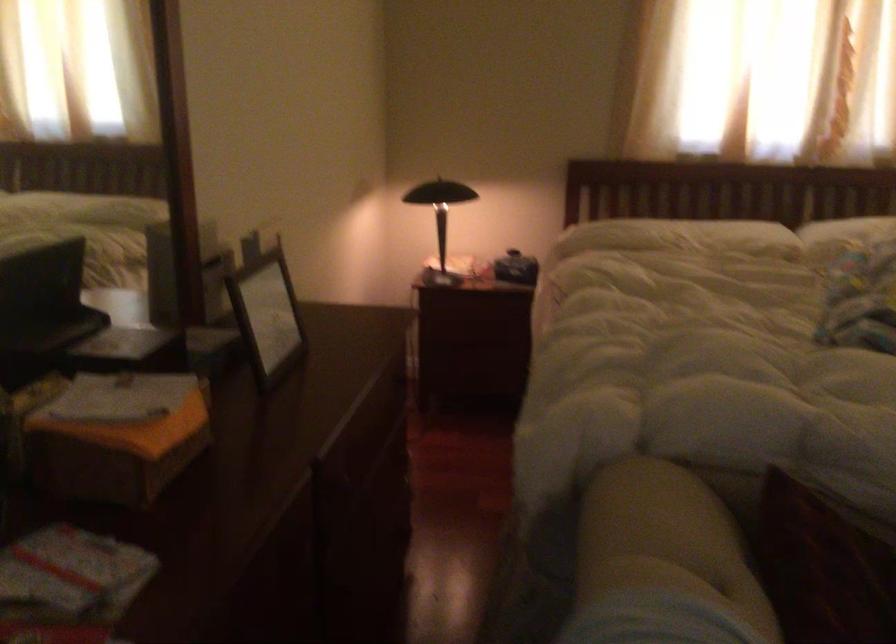
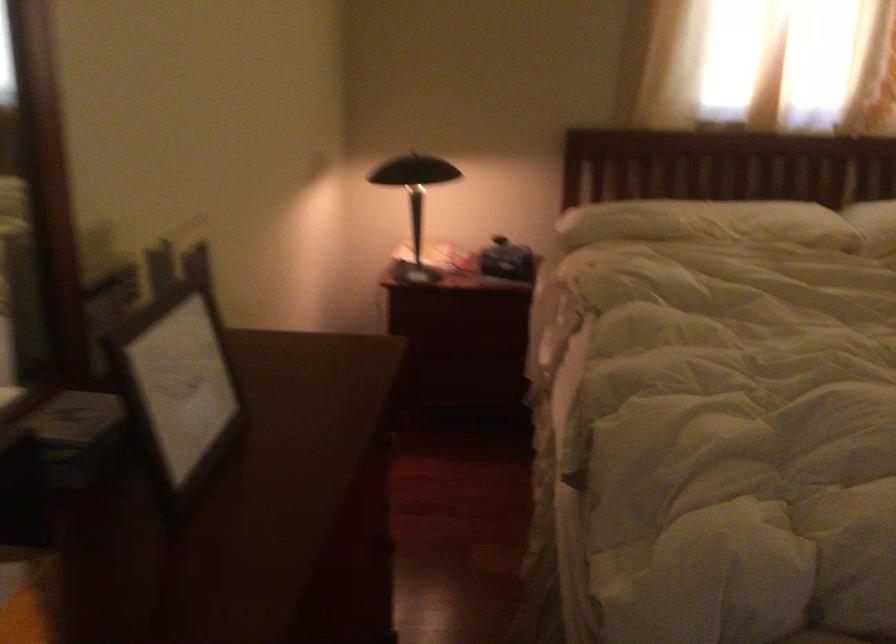
Find the pixel in the second image that matches point (257, 319) in the first image.

(177, 386)